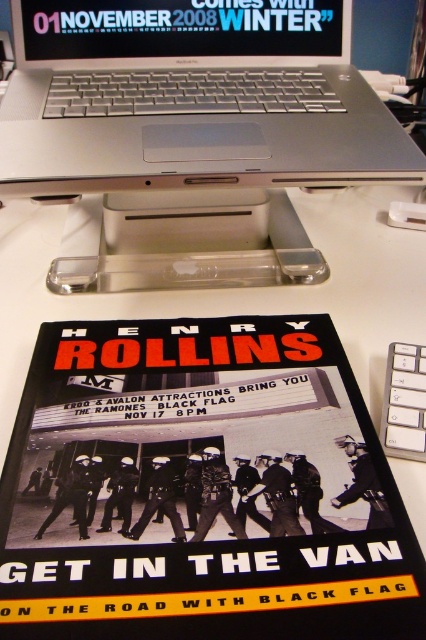
You are a photographer standing 12 inches away from the desk where the black paper poster at lower center is placed. You want to take a clear photo of the poster without any obstruction. Is the poster within your camera range?

The black paper poster at lower center is 11.48 inches from viewer, so yes, the poster is within your camera range since it is closer than the 12 inches distance you are standing at.

You are a photographer adjusting your camera to focus on the two points in the image. Which point, point (397, 582) or point (57, 26), is closer to your camera lens?

Point (397, 582) is closer to the camera lens than point (57, 26).

You are organizing a music event and need to place a new poster above the silver metallic laptop at upper center. However, you want to ensure it doesn not block the black paper poster at lower center. Can you hang the new poster without covering the existing one?

The black paper poster at lower center is closer to the viewer than the silver metallic laptop at upper center. Therefore, placing a new poster above the silver metallic laptop at upper center would not block the black paper poster at lower center since it is already closer and positioned lower.